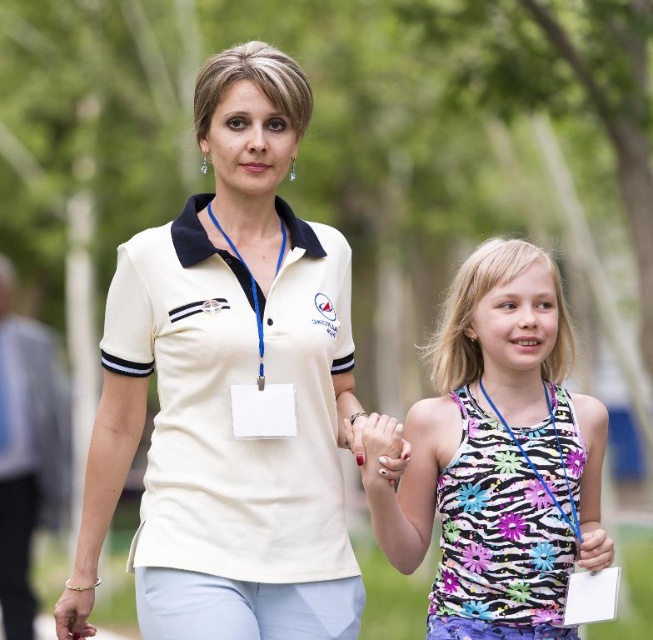
You are standing in the park and see two points marked in the image. Which point is closer to you, point (347, 316) or point (65, 372)?

Point (347, 316) is in front of point (65, 372), so it is closer to you.

You are a photographer trying to capture a photo of two people in the park. You notice the white matte shirt at center and the printed fabric tank top at center. Which clothing item is positioned closer to the left side of the image?

The white matte shirt at center is positioned to the left of the printed fabric tank top at center, making it closer to the left side of the image.